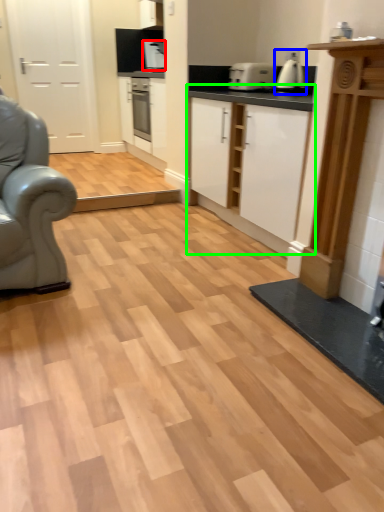
Question: Which object is positioned closest to coffee machine (highlighted by a red box)? Select from coffee machine (highlighted by a blue box) and cabinetry (highlighted by a green box).

Choices:
 (A) coffee machine
 (B) cabinetry

Answer: (B)